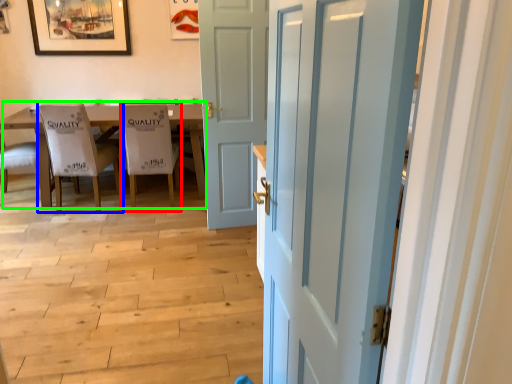
Question: Considering the real-world distances, which object is farthest from chair (highlighted by a red box)? chair (highlighted by a blue box) or kitchen & dining room table (highlighted by a green box)?

Choices:
 (A) chair
 (B) kitchen & dining room table

Answer: (B)